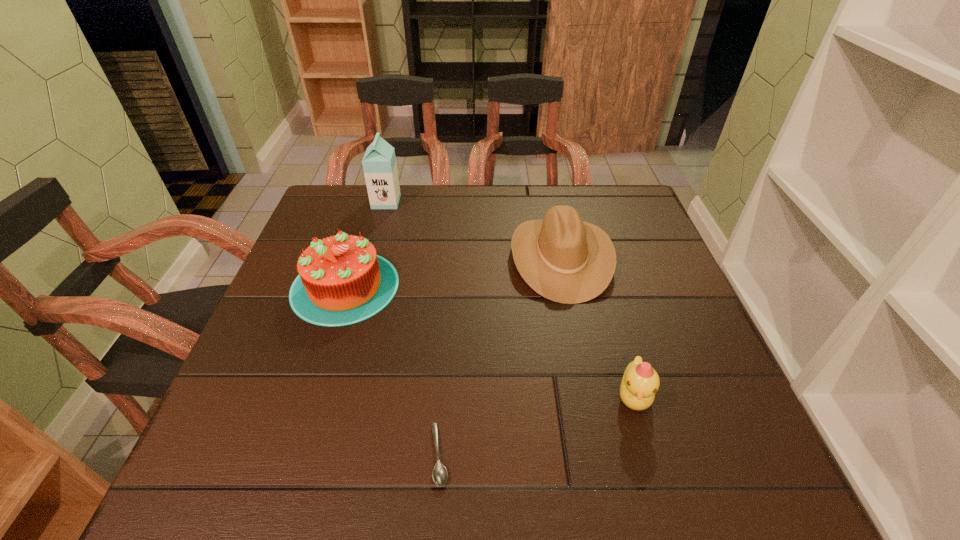
Identify the location of empty space between the cowboy hat and the farthest object. (473, 230).

Locate an element on the screen. The image size is (960, 540). vacant space in between the third object from left to right and the milk carton is located at coordinates (x=413, y=328).

This screenshot has width=960, height=540. In order to click on empty location between the shortest object and the cake in this screenshot , I will do `click(392, 370)`.

Find the location of `free point between the duckling and the shortest object`. free point between the duckling and the shortest object is located at coordinates point(536,426).

In order to click on vacant point located between the milk carton and the duckling in this screenshot , I will do `click(510, 299)`.

The height and width of the screenshot is (540, 960). What are the coordinates of `free area in between the cake and the soupspoon` in the screenshot? It's located at (392, 370).

The height and width of the screenshot is (540, 960). Identify the location of free point between the duckling and the farthest object. (510, 299).

I want to click on vacant point located between the milk carton and the duckling, so click(510, 299).

The height and width of the screenshot is (540, 960). What are the coordinates of `object that is the closest to the tallest object` in the screenshot? It's located at (342, 281).

Locate an element on the screen. The height and width of the screenshot is (540, 960). object that is the second closest one to the duckling is located at coordinates (439, 474).